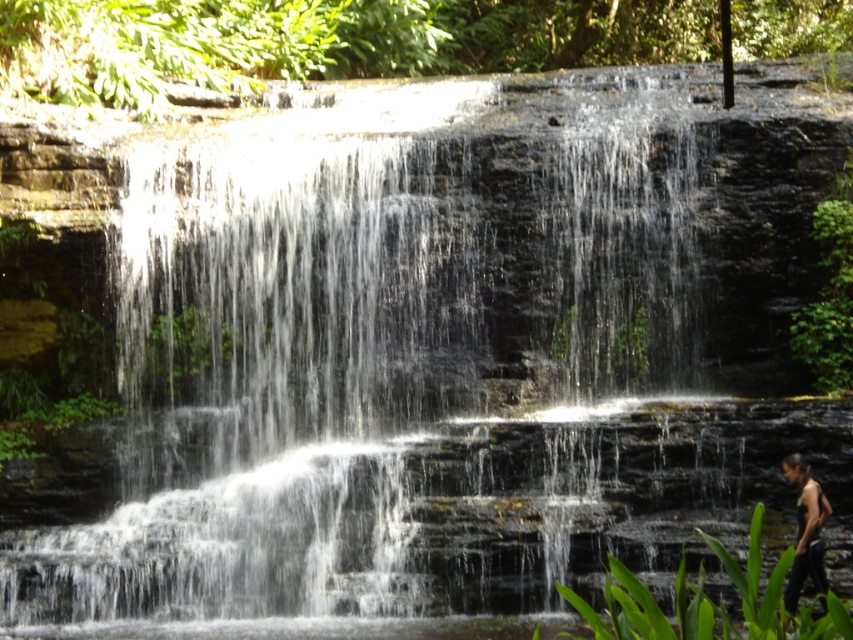
Question: Considering the real-world distances, which object is farthest from the green leafy plant at lower right?

Choices:
 (A) green leafy vegetation at upper center
 (B) black tank top at lower right

Answer: (A)

Question: Estimate the real-world distances between objects in this image. Which object is closer to the green leafy plant at lower right?

Choices:
 (A) green leafy plant at right
 (B) black tank top at lower right
 (C) green leafy vegetation at upper center

Answer: (B)

Question: Does green leafy plant at lower right appear on the right side of green leafy plant at right?

Choices:
 (A) yes
 (B) no

Answer: (B)

Question: Which object is positioned farthest from the green leafy plant at right?

Choices:
 (A) black tank top at lower right
 (B) green leafy vegetation at upper center
 (C) green leafy plant at lower right

Answer: (B)

Question: Is green leafy plant at lower right further to the viewer compared to black tank top at lower right?

Choices:
 (A) yes
 (B) no

Answer: (B)

Question: Can you confirm if green leafy vegetation at upper center is positioned to the right of black tank top at lower right?

Choices:
 (A) no
 (B) yes

Answer: (A)